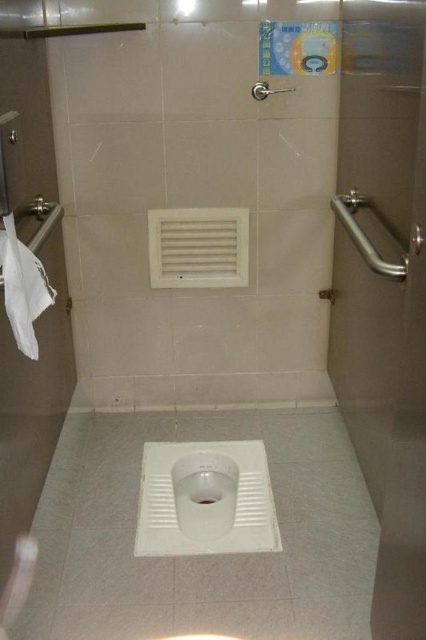
Consider the image. Does white fabric at left appear under satin nickel shower handle at upper center?

Indeed, white fabric at left is positioned under satin nickel shower handle at upper center.

Can you confirm if white fabric at left is shorter than satin nickel shower handle at upper center?

No.

Between point (34, 314) and point (291, 88), which one is positioned behind?

The point (291, 88) is behind.

Image resolution: width=426 pixels, height=640 pixels. I want to click on white fabric at left, so click(x=23, y=288).

Which is more to the left, satin nickel shower handle at upper center or white glossy drain at center?

Positioned to the left is white glossy drain at center.

Who is higher up, satin nickel shower handle at upper center or white glossy drain at center?

satin nickel shower handle at upper center is above.

At what (x,y) coordinates should I click in order to perform the action: click on satin nickel shower handle at upper center. Please return your answer as a coordinate pair (x, y). This screenshot has height=640, width=426. Looking at the image, I should click on (267, 90).

Find the location of a particular element. white glossy toilet bowl at center is located at coordinates [204, 493].

Can you confirm if white glossy toilet bowl at center is positioned above white fabric at left?

Incorrect, white glossy toilet bowl at center is not positioned above white fabric at left.

Is point (204, 518) farther from viewer compared to point (42, 291)?

Yes.

Identify the location of white glossy toilet bowl at center. The image size is (426, 640). (204, 493).